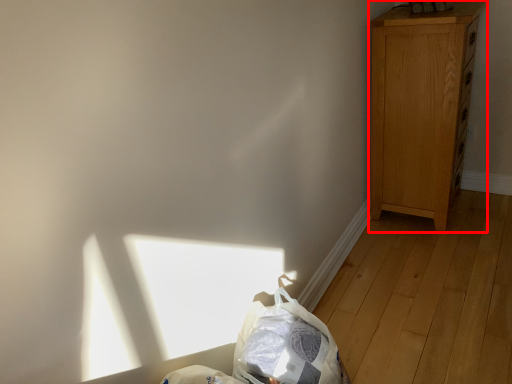
Question: Observing the image, what is the correct spatial positioning of dresser (annotated by the red box) in reference to diaper bag?

Choices:
 (A) left
 (B) right

Answer: (B)